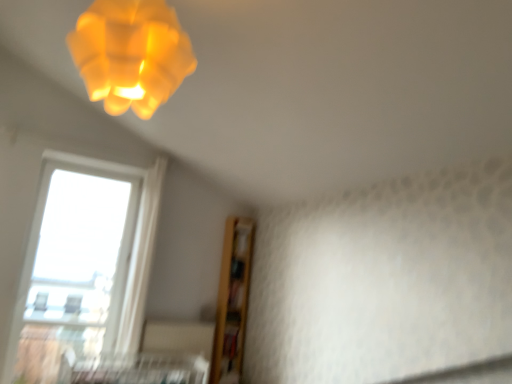
Question: Is matte yellow plastic lamp at upper left smaller than metallic silver bed frame at lower center?

Choices:
 (A) yes
 (B) no

Answer: (B)

Question: Is matte yellow plastic lamp at upper left further to camera compared to metallic silver bed frame at lower center?

Choices:
 (A) yes
 (B) no

Answer: (B)

Question: Considering the relative positions of matte yellow plastic lamp at upper left and metallic silver bed frame at lower center in the image provided, is matte yellow plastic lamp at upper left in front of metallic silver bed frame at lower center?

Choices:
 (A) yes
 (B) no

Answer: (A)

Question: Are matte yellow plastic lamp at upper left and metallic silver bed frame at lower center far apart?

Choices:
 (A) yes
 (B) no

Answer: (A)

Question: Is matte yellow plastic lamp at upper left not within metallic silver bed frame at lower center?

Choices:
 (A) no
 (B) yes

Answer: (B)

Question: Looking at the image, does metallic silver bed frame at lower center seem bigger or smaller compared to matte yellow plastic lamp at upper left?

Choices:
 (A) small
 (B) big

Answer: (A)

Question: From their relative heights in the image, would you say metallic silver bed frame at lower center is taller or shorter than matte yellow plastic lamp at upper left?

Choices:
 (A) tall
 (B) short

Answer: (B)

Question: Does point (111, 380) appear closer or farther from the camera than point (152, 14)?

Choices:
 (A) farther
 (B) closer

Answer: (A)

Question: From a real-world perspective, is metallic silver bed frame at lower center positioned above or below matte yellow plastic lamp at upper left?

Choices:
 (A) above
 (B) below

Answer: (B)

Question: From a real-world perspective, is metallic silver bed frame at lower center physically located above or below transparent glass window at lower left?

Choices:
 (A) above
 (B) below

Answer: (B)

Question: From their relative heights in the image, would you say metallic silver bed frame at lower center is taller or shorter than transparent glass window at lower left?

Choices:
 (A) tall
 (B) short

Answer: (B)

Question: Is metallic silver bed frame at lower center in front of or behind transparent glass window at lower left in the image?

Choices:
 (A) front
 (B) behind

Answer: (A)

Question: Is metallic silver bed frame at lower center inside the boundaries of transparent glass window at lower left, or outside?

Choices:
 (A) inside
 (B) outside

Answer: (B)

Question: Looking at their shapes, would you say matte yellow plastic lamp at upper left is wider or thinner than metallic silver bed frame at lower center?

Choices:
 (A) wide
 (B) thin

Answer: (B)

Question: Does point (144, 34) appear closer or farther from the camera than point (96, 375)?

Choices:
 (A) farther
 (B) closer

Answer: (B)